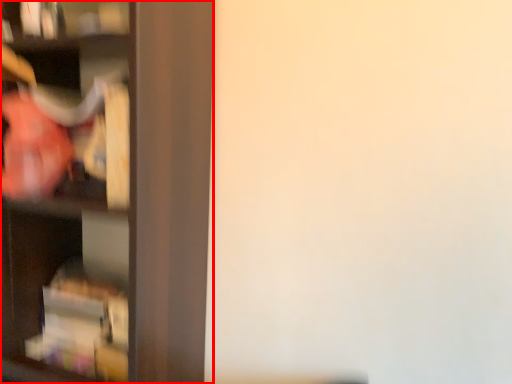
Question: In this image, where is shelf (annotated by the red box) located relative to cabinet?

Choices:
 (A) right
 (B) left

Answer: (A)